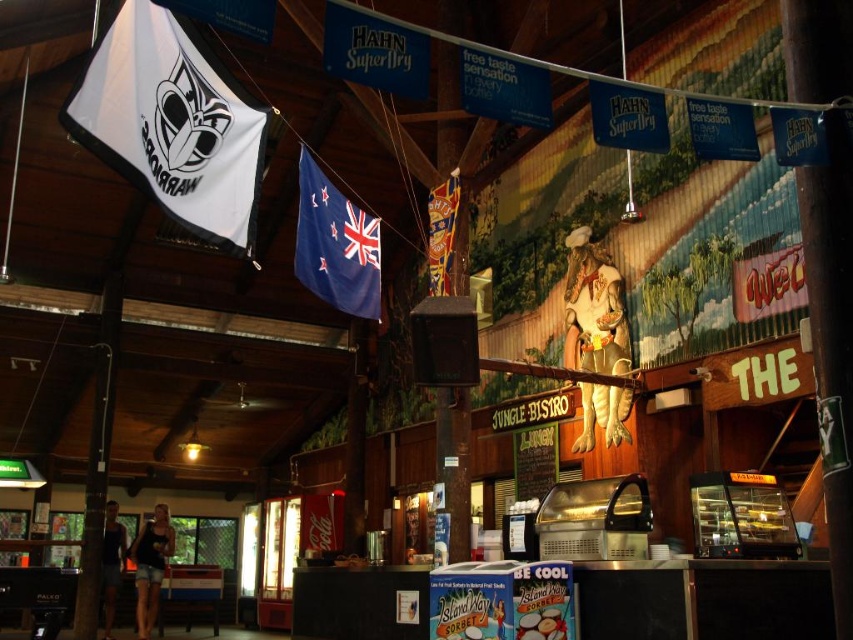
Can you confirm if white fabric flag at upper left is positioned below blue fabric flag at center?

Correct, white fabric flag at upper left is located below blue fabric flag at center.

Which is behind, point (200, 86) or point (431, 232)?

The point (431, 232) is more distant.

Does point (149, 90) come in front of point (433, 220)?

Yes, point (149, 90) is closer to viewer.

Locate an element on the screen. white fabric flag at upper left is located at coordinates (172, 124).

Who is more distant from viewer, (346, 232) or (440, 285)?

The point (440, 285) is more distant.

Is blue fabric flag at upper center in front of blue fabric flag at center?

That is True.

Who is more distant from viewer, (x=334, y=256) or (x=440, y=289)?

Point (x=440, y=289)

Locate an element on the screen. This screenshot has height=640, width=853. blue fabric flag at upper center is located at coordinates (335, 244).

Locate an element on the screen. This screenshot has width=853, height=640. white fabric flag at upper left is located at coordinates (172, 124).

Between white fabric flag at upper left and blue fabric flag at upper center, which one has more height?

Standing taller between the two is blue fabric flag at upper center.

What are the coordinates of `white fabric flag at upper left` in the screenshot? It's located at (172, 124).

Image resolution: width=853 pixels, height=640 pixels. Find the location of `white fabric flag at upper left`. white fabric flag at upper left is located at coordinates (172, 124).